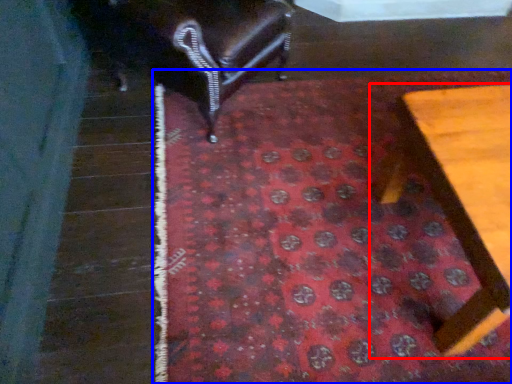
Question: Among these objects, which one is nearest to the camera, furniture (highlighted by a red box) or mat (highlighted by a blue box)?

Choices:
 (A) furniture
 (B) mat

Answer: (A)